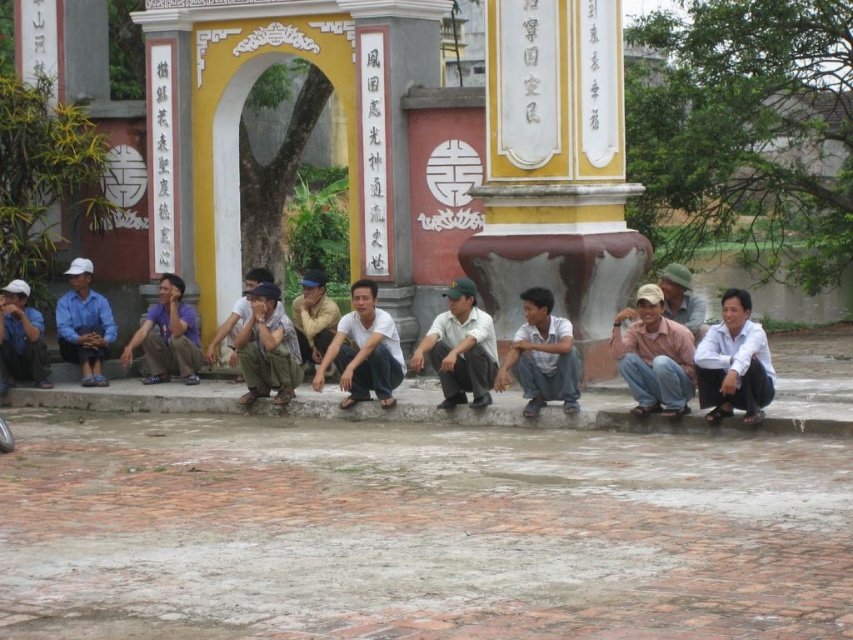
You are a photographer trying to capture a candid shot of the light blue jeans at center and the white cotton shirt at center. Since you want to ensure both are clearly visible, which one should you focus on first to avoid blurring due to their size?

The light blue jeans at center is smaller than the white cotton shirt at center, so you should focus on the light blue jeans at center first to ensure clarity before capturing the larger white cotton shirt at center.

You are taking a photo of the scene and want to ensure both the light blue jeans at center and the white cotton shirt at center are visible. Which one should you focus on first if you want to capture the one closer to the left side?

The white cotton shirt at center is on the left side of the light blue jeans at center, so you should focus on the white cotton shirt at center first to capture the one closer to the left side.